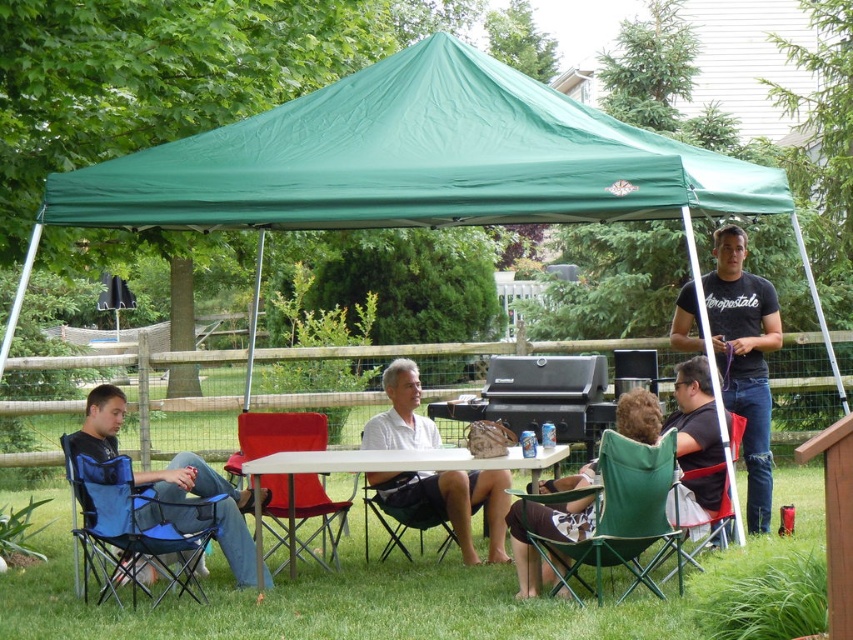
Does matte red folding chair at center have a lesser width compared to green fabric chair at center?

No.

Who is lower down, matte red folding chair at center or green fabric chair at center?

matte red folding chair at center

The image size is (853, 640). What do you see at coordinates (276, 435) in the screenshot?
I see `matte red folding chair at center` at bounding box center [276, 435].

At what (x,y) coordinates should I click in order to perform the action: click on matte red folding chair at center. Please return your answer as a coordinate pair (x, y). The width and height of the screenshot is (853, 640). Looking at the image, I should click on 276,435.

What do you see at coordinates (415, 161) in the screenshot? I see `green fabric canopy at upper center` at bounding box center [415, 161].

Is green fabric canopy at upper center positioned before blue fabric folding chair at lower left?

Yes, green fabric canopy at upper center is closer to the viewer.

Where is `green fabric canopy at upper center`? This screenshot has width=853, height=640. green fabric canopy at upper center is located at coordinates (415, 161).

Find the location of a particular element. This screenshot has width=853, height=640. green fabric canopy at upper center is located at coordinates (415, 161).

Consider the image. Who is shorter, black t-shirt at center or matte red folding chair at center?

matte red folding chair at center is shorter.

Does black t-shirt at center appear on the right side of matte red folding chair at center?

Correct, you'll find black t-shirt at center to the right of matte red folding chair at center.

Who is more distant from viewer, (727, 396) or (297, 500)?

Positioned behind is point (297, 500).

Find the location of a particular element. black t-shirt at center is located at coordinates (744, 358).